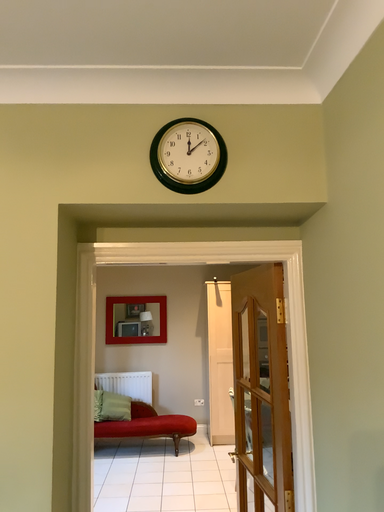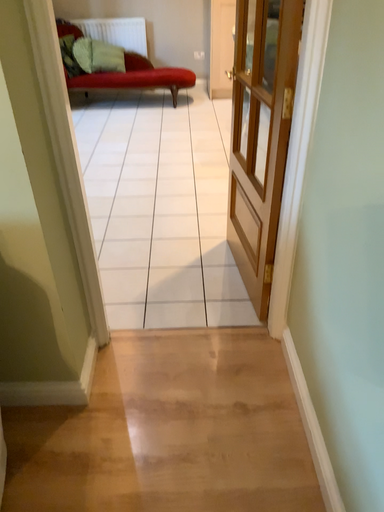
Question: Which way did the camera rotate in the video?

Choices:
 (A) rotated upward
 (B) rotated downward

Answer: (B)